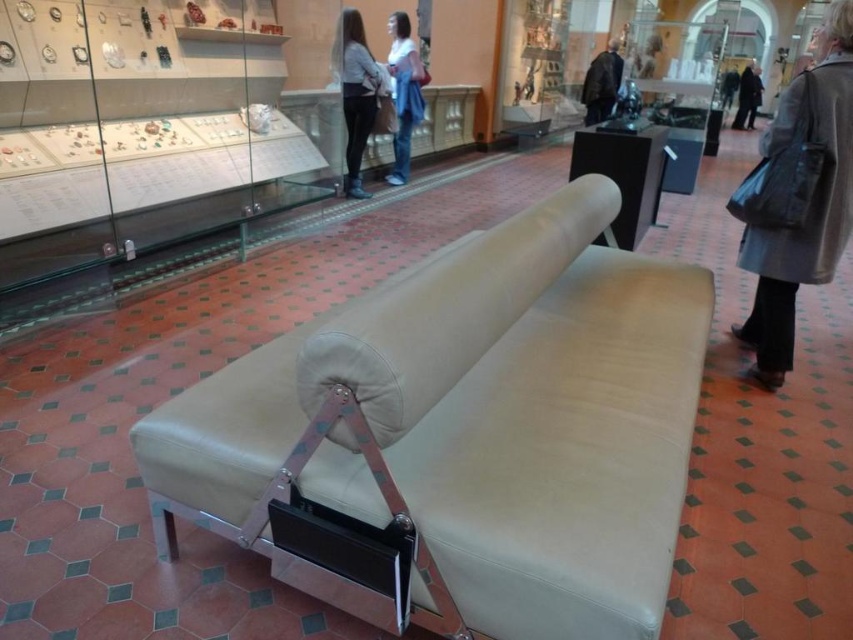
Question: Can you confirm if beige leather couch at center is bigger than gray wool coat at right?

Choices:
 (A) yes
 (B) no

Answer: (A)

Question: Which object is the farthest from the white cotton shirt at upper center?

Choices:
 (A) light gray sweater at center
 (B) beige leather couch at center
 (C) matte black speaker at upper center

Answer: (B)

Question: Considering the relative positions of gray wool coat at right and light gray sweater at center in the image provided, where is gray wool coat at right located with respect to light gray sweater at center?

Choices:
 (A) right
 (B) left

Answer: (A)

Question: Which object is closer to the camera taking this photo?

Choices:
 (A) gray wool coat at right
 (B) matte black speaker at upper center

Answer: (A)

Question: Is gray wool coat at right further to the viewer compared to light gray sweater at center?

Choices:
 (A) yes
 (B) no

Answer: (B)

Question: Among these points, which one is nearest to the camera?

Choices:
 (A) (619, 428)
 (B) (363, 93)
 (C) (791, 97)

Answer: (A)